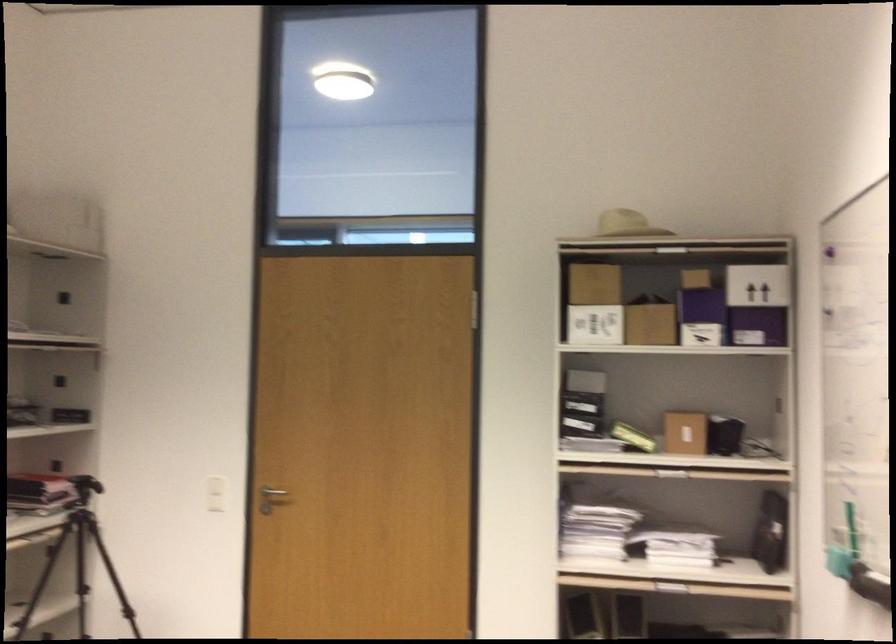
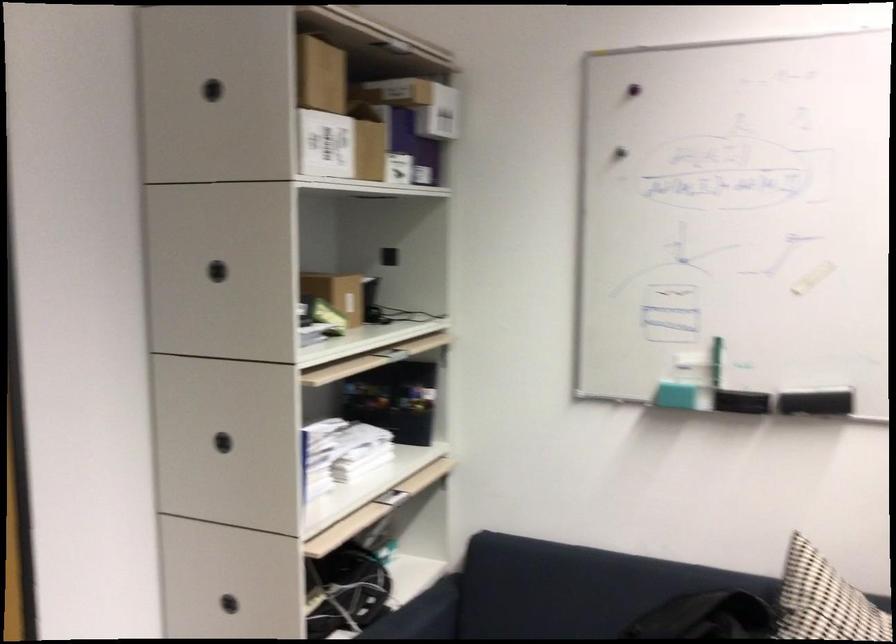
Where in the second image is the point corresponding to pixel 572 502 from the first image?

(222, 442)